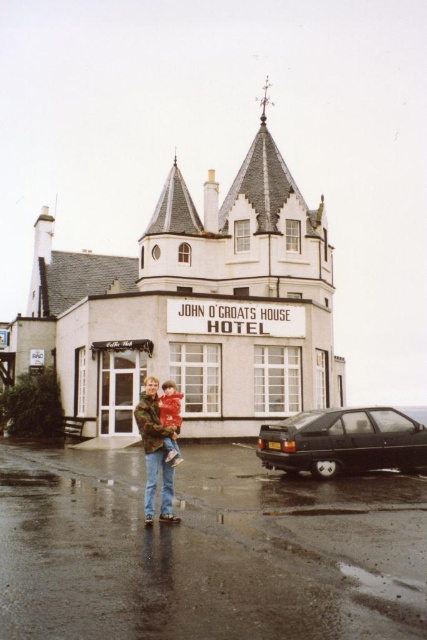
Who is taller, camouflage jacket at center or camouflage-patterned jacket at center?

camouflage jacket at center

Between camouflage jacket at center and camouflage-patterned jacket at center, which one appears on the left side from the viewer's perspective?

From the viewer's perspective, camouflage jacket at center appears more on the left side.

Is point (157, 384) positioned behind point (169, 381)?

No, (157, 384) is closer to viewer.

At what (x,y) coordinates should I click in order to perform the action: click on camouflage jacket at center. Please return your answer as a coordinate pair (x, y). The width and height of the screenshot is (427, 640). Looking at the image, I should click on (155, 452).

The width and height of the screenshot is (427, 640). Find the location of `black matte car at lower right`. black matte car at lower right is located at coordinates pos(344,442).

Between black matte car at lower right and camouflage jacket at center, which one has more height?

camouflage jacket at center is taller.

The image size is (427, 640). Describe the element at coordinates (344, 442) in the screenshot. I see `black matte car at lower right` at that location.

The height and width of the screenshot is (640, 427). What are the coordinates of `black matte car at lower right` in the screenshot? It's located at (344, 442).

Which is above, black matte car at lower right or camouflage-patterned jacket at center?

camouflage-patterned jacket at center is higher up.

Who is more distant from viewer, (397, 444) or (167, 445)?

The point (397, 444) is behind.

I want to click on black matte car at lower right, so click(344, 442).